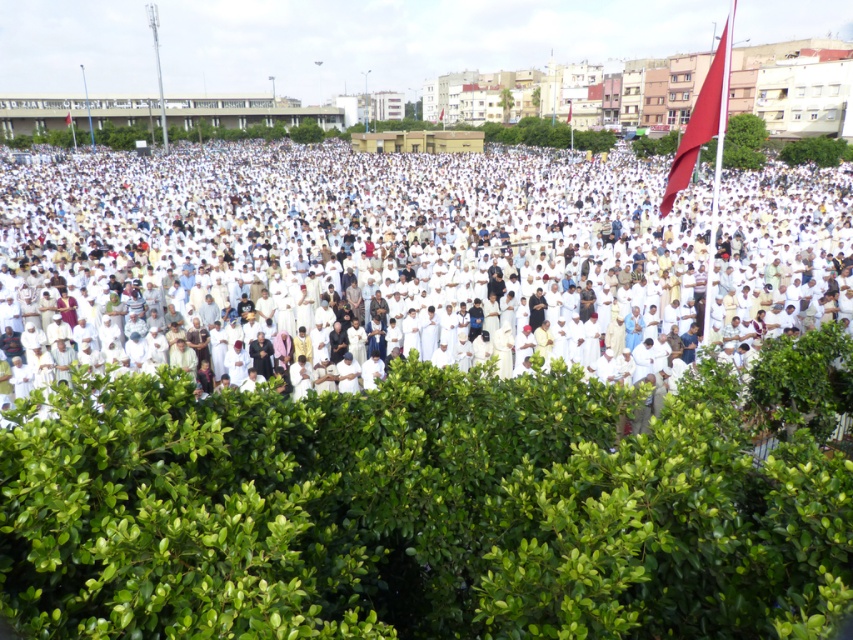
You are a photographer trying to capture the entire scene of the crowd and the flag. Given that the white matte clothing at center takes up more space than the matte red flag at upper right, how would you adjust your camera angle to ensure both are clearly visible in the photo?

Since the white matte clothing at center is larger in size than the matte red flag at upper right, you can position the camera slightly lower to include more of the background where the flag is located while still capturing the crowd in the foreground.

You are a photographer at the event and want to capture both the white matte clothing at center and the matte red flag at upper right in the same frame. Based on their positions, which object will appear larger in your photo?

The white matte clothing at center appears larger in the photo because it is closer to the viewer than the matte red flag at upper right.

From the picture: You are a photographer at the event and want to capture both the white matte clothing at center and the matte red flag at upper right in a single shot. Based on their positions, which object should you focus on first to ensure both are in the frame?

The white matte clothing at center is located above the matte red flag at upper right, so you should focus on the white matte clothing at center first to ensure both are in the frame.